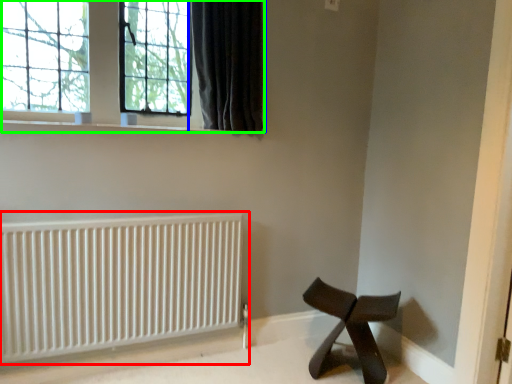
Question: Which object is the farthest from radiator (highlighted by a red box)? Choose among these: curtain (highlighted by a blue box) or window (highlighted by a green box).

Choices:
 (A) curtain
 (B) window

Answer: (A)